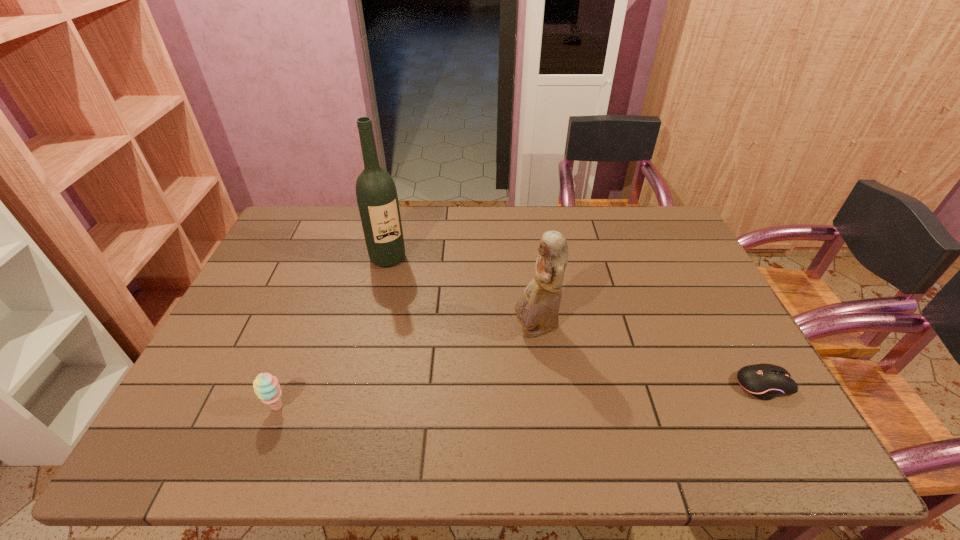
This screenshot has height=540, width=960. What are the coordinates of `the third tallest object` in the screenshot? It's located at (266, 387).

The image size is (960, 540). I want to click on sherbert, so click(x=266, y=387).

Find the location of `the shortest object`. the shortest object is located at coordinates (764, 381).

The image size is (960, 540). I want to click on computer mouse, so click(x=764, y=381).

Where is `figurine`? The image size is (960, 540). figurine is located at coordinates pyautogui.click(x=537, y=308).

Locate an element on the screen. The width and height of the screenshot is (960, 540). the second object from right to left is located at coordinates (537, 308).

Locate an element on the screen. the tallest object is located at coordinates (376, 193).

Identify the location of wine bottle. The width and height of the screenshot is (960, 540). (376, 193).

Locate an element on the screen. This screenshot has height=540, width=960. vacant area situated 0.080m on the back of the leftmost object is located at coordinates (292, 369).

Identify the location of blank space located 0.220m on the back of the rightmost object. The height and width of the screenshot is (540, 960). (719, 307).